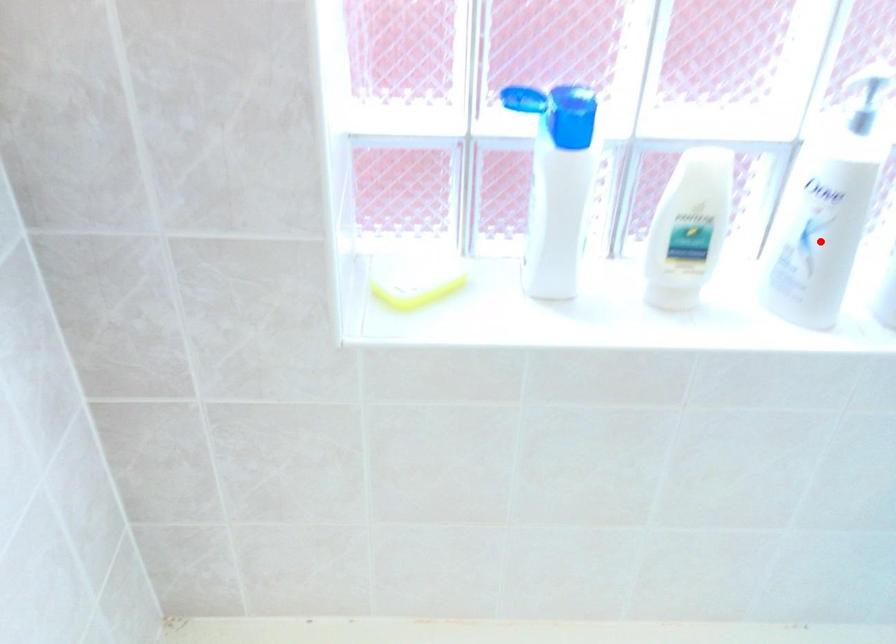
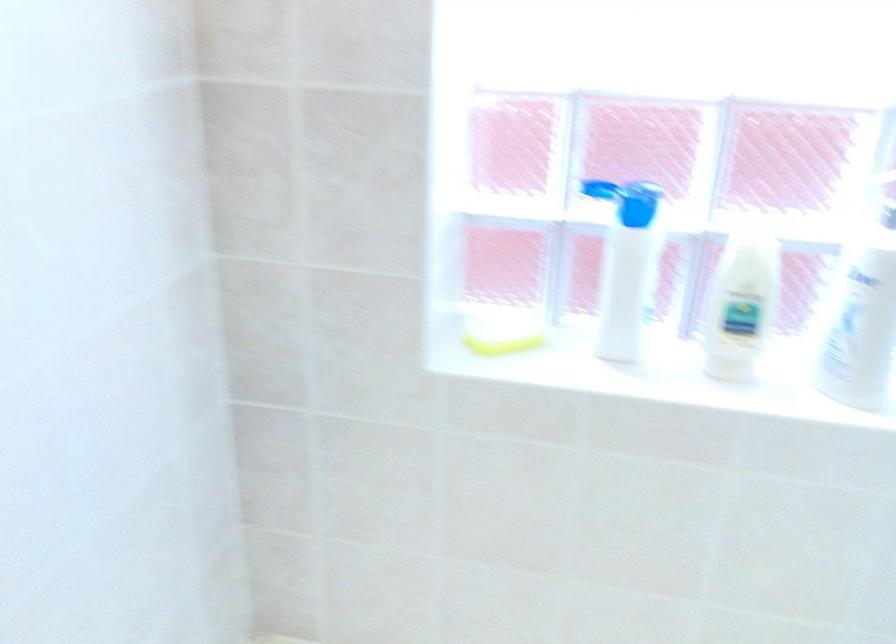
Question: I am providing you with two images of the same scene from different viewpoints. A red point is shown in image1. For the corresponding object point in image2, is it positioned nearer or farther from the camera?

Choices:
 (A) Nearer
 (B) Farther

Answer: (B)